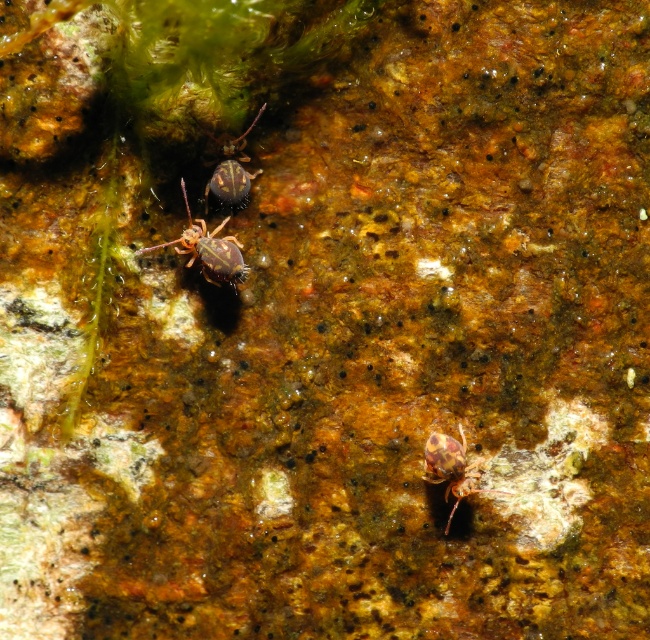
You are an entomologist examining the rocky surface. You notice two spiders, the brown spotted spider at center and the shiny brown spider at center. Which spider is located to the right of the other?

The brown spotted spider at center is positioned on the right side of the shiny brown spider at center.

In the scene shown: You are observing the rocky surface and notice two points marked on it. Which point is nearer to you, point (460, 497) or point (218, 164)?

Point (460, 497) is closer to the viewer than point (218, 164).